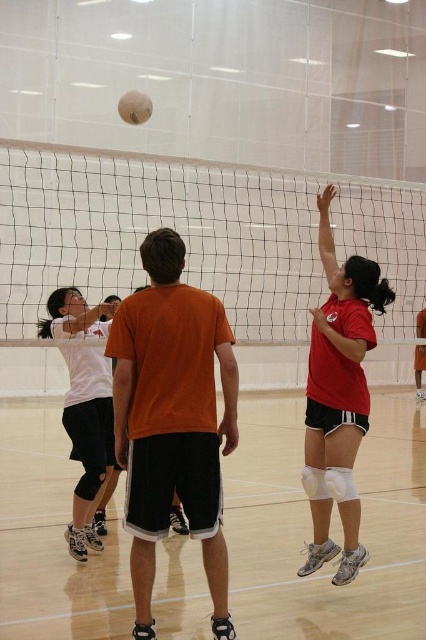
Which is behind, point (373, 461) or point (230, 624)?

The point (373, 461) is more distant.

Is white matte knee pads at center shorter than orange matte t-shirt at center?

Indeed, white matte knee pads at center has a lesser height compared to orange matte t-shirt at center.

The width and height of the screenshot is (426, 640). Find the location of `white matte knee pads at center`. white matte knee pads at center is located at coordinates (310, 529).

Does white matte knee pads at center have a larger size compared to beige fabric volleyball at upper center?

Yes.

Describe the element at coordinates (310, 529) in the screenshot. The image size is (426, 640). I see `white matte knee pads at center` at that location.

Between point (423, 573) and point (120, 116), which one is positioned in front?

Point (423, 573) is more forward.

I want to click on white matte knee pads at center, so click(x=310, y=529).

Between matte red shirt at right and white matte shirt at center, which one appears on the left side from the viewer's perspective?

white matte shirt at center

Is point (319, 499) closer to viewer compared to point (100, 474)?

Yes.

The image size is (426, 640). What do you see at coordinates (337, 397) in the screenshot?
I see `matte red shirt at right` at bounding box center [337, 397].

Identify the location of matte red shirt at right. (337, 397).